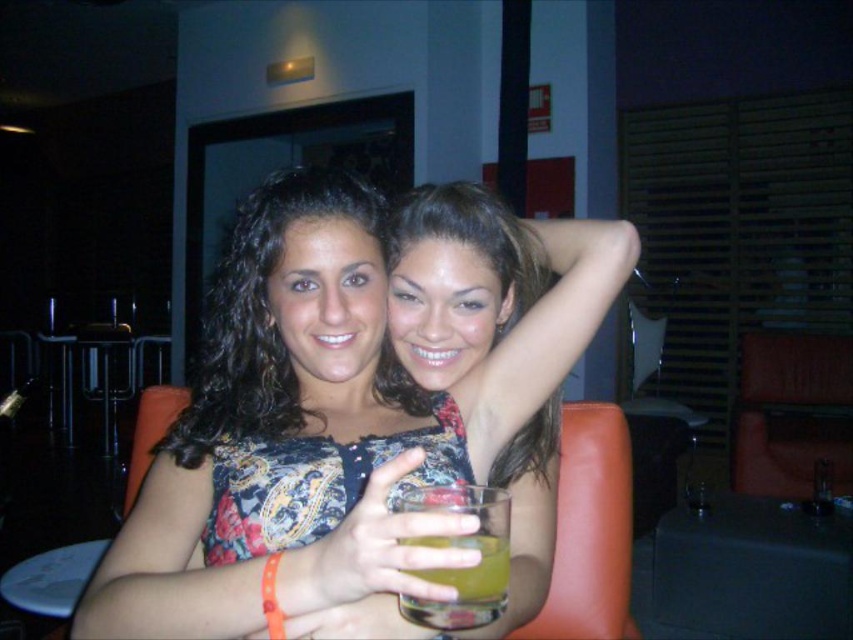
Is point (550, 240) behind point (424, 492)?

Yes, it is behind point (424, 492).

Consider the image. Does floral-patterned dress at center have a lesser height compared to translucent glass at center?

In fact, floral-patterned dress at center may be taller than translucent glass at center.

Who is more forward, (270,184) or (502,529)?

Point (502,529) is in front.

Find the location of a particular element. This screenshot has width=853, height=640. floral-patterned dress at center is located at coordinates (326, 428).

Which is more to the left, matte floral dress at center or leather armchair at right?

matte floral dress at center is more to the left.

From the picture: How much distance is there between matte floral dress at center and leather armchair at right?

A distance of 2.78 meters exists between matte floral dress at center and leather armchair at right.

Is point (402, 304) less distant than point (782, 420)?

Yes, point (402, 304) is in front of point (782, 420).

Locate an element on the screen. The height and width of the screenshot is (640, 853). matte floral dress at center is located at coordinates click(x=471, y=276).

Is leather at right below leather armchair at right?

No, leather at right is not below leather armchair at right.

Does point (575, 449) come behind point (747, 445)?

No, (575, 449) is closer to viewer.

Is point (572, 593) behind point (840, 417)?

No.

Find the location of a particular element. Image resolution: width=853 pixels, height=640 pixels. leather at right is located at coordinates (589, 531).